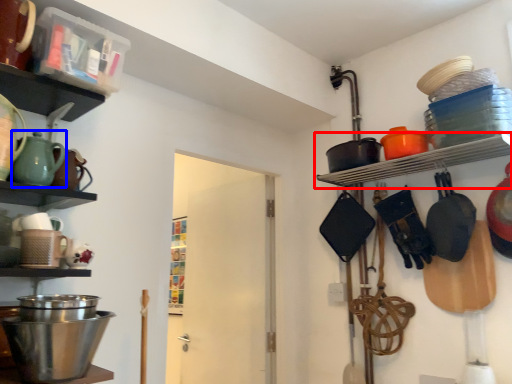
Question: Among these objects, which one is nearest to the camera, shelf (highlighted by a red box) or tea pot (highlighted by a blue box)?

Choices:
 (A) shelf
 (B) tea pot

Answer: (B)